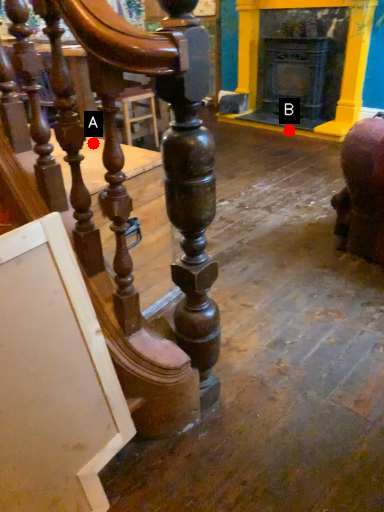
Question: Two points are circled on the image, labeled by A and B beside each circle. Which point is further to the camera?

Choices:
 (A) A is further
 (B) B is further

Answer: (B)